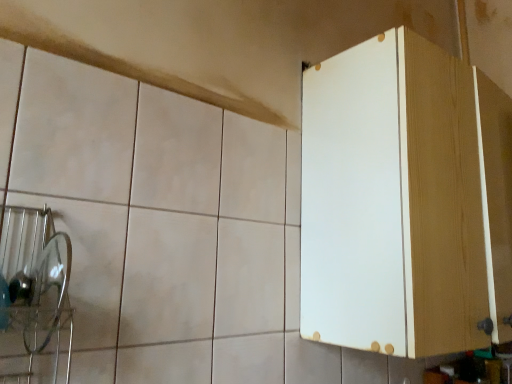
What do you see at coordinates (90, 263) in the screenshot? The width and height of the screenshot is (512, 384). I see `translucent glass plate at left` at bounding box center [90, 263].

This screenshot has height=384, width=512. Find the location of `translucent glass plate at left`. translucent glass plate at left is located at coordinates (90, 263).

This screenshot has height=384, width=512. What do you see at coordinates (405, 201) in the screenshot?
I see `white wood cabinet at right` at bounding box center [405, 201].

The image size is (512, 384). I want to click on white wood cabinet at right, so click(405, 201).

The image size is (512, 384). Identify the location of translucent glass plate at left. (90, 263).

Is translucent glass plate at left to the right of white wood cabinet at right from the viewer's perspective?

No, translucent glass plate at left is not to the right of white wood cabinet at right.

Does translucent glass plate at left come in front of white wood cabinet at right?

Yes, translucent glass plate at left is in front of white wood cabinet at right.

Does point (48, 201) lie behind point (428, 73)?

That is False.

From the image's perspective, which is below, translucent glass plate at left or white wood cabinet at right?

translucent glass plate at left appears lower in the image.

From a real-world perspective, which is physically above, translucent glass plate at left or white wood cabinet at right?

white wood cabinet at right.

Considering the sizes of objects translucent glass plate at left and white wood cabinet at right in the image provided, who is wider, translucent glass plate at left or white wood cabinet at right?

Wider between the two is white wood cabinet at right.

Is translucent glass plate at left taller or shorter than white wood cabinet at right?

In the image, translucent glass plate at left appears to be shorter than white wood cabinet at right.

Which of these two, translucent glass plate at left or white wood cabinet at right, is smaller?

translucent glass plate at left.

Would you say translucent glass plate at left is inside or outside white wood cabinet at right?

translucent glass plate at left exists outside the volume of white wood cabinet at right.

Are translucent glass plate at left and white wood cabinet at right located far from each other?

No, there isn't a large distance between translucent glass plate at left and white wood cabinet at right.

Is translucent glass plate at left facing towards white wood cabinet at right?

No, translucent glass plate at left does not turn towards white wood cabinet at right.

How different are the orientations of translucent glass plate at left and white wood cabinet at right in degrees?

0.559 degrees separate the facing orientations of translucent glass plate at left and white wood cabinet at right.

Find the location of a particular element. Image resolution: width=512 pixels, height=384 pixels. cabinetry that is on the right side of translucent glass plate at left is located at coordinates (405, 201).

In the image, is white wood cabinet at right on the left side or the right side of translucent glass plate at left?

In the image, white wood cabinet at right appears on the right side of translucent glass plate at left.

Relative to translucent glass plate at left, is white wood cabinet at right in front or behind?

Visually, white wood cabinet at right is located behind translucent glass plate at left.

In the scene shown: Which point is more distant from viewer, (400, 165) or (84, 275)?

The point (400, 165) is more distant.

From the image's perspective, which object appears higher, white wood cabinet at right or translucent glass plate at left?

white wood cabinet at right appears higher in the image.

From a real-world perspective, who is located higher, white wood cabinet at right or translucent glass plate at left?

white wood cabinet at right, from a real-world perspective.

Considering the relative sizes of white wood cabinet at right and translucent glass plate at left in the image provided, is white wood cabinet at right wider than translucent glass plate at left?

Yes.

Is white wood cabinet at right taller or shorter than translucent glass plate at left?

white wood cabinet at right is taller than translucent glass plate at left.

From the picture: Does white wood cabinet at right have a larger size compared to translucent glass plate at left?

Yes.

Choose the correct answer: Is white wood cabinet at right inside translucent glass plate at left or outside it?

white wood cabinet at right is spatially situated outside translucent glass plate at left.

Is white wood cabinet at right next to translucent glass plate at left and touching it?

No, white wood cabinet at right is not with translucent glass plate at left.

Is white wood cabinet at right oriented towards translucent glass plate at left?

No.

What's the angular difference between white wood cabinet at right and translucent glass plate at left's facing directions?

0.559 degrees separate the facing orientations of white wood cabinet at right and translucent glass plate at left.

The image size is (512, 384). I want to click on ceramic tile below the white wood cabinet at right (from the image's perspective), so click(x=90, y=263).

This screenshot has height=384, width=512. Find the location of `ceramic tile below the white wood cabinet at right (from a real-world perspective)`. ceramic tile below the white wood cabinet at right (from a real-world perspective) is located at coordinates (90, 263).

Identify the location of ceramic tile that is in front of the white wood cabinet at right. This screenshot has height=384, width=512. (90, 263).